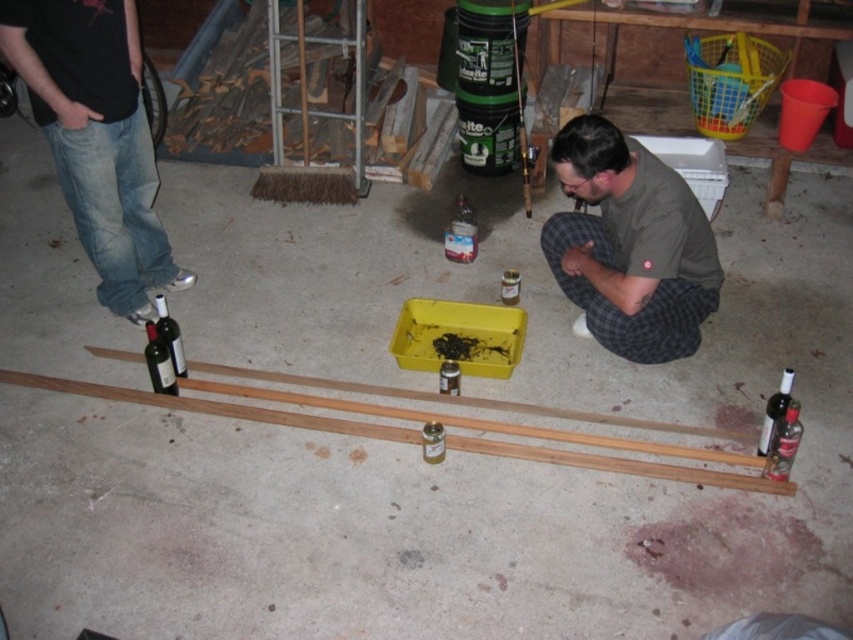
Where is `clear plastic bottle at center`? This screenshot has height=640, width=853. clear plastic bottle at center is located at coordinates (460, 232).

Looking at this image, who is more forward, (x=453, y=252) or (x=756, y=445)?

Positioned in front is point (x=756, y=445).

Identify the location of clear plastic bottle at center. The height and width of the screenshot is (640, 853). (460, 232).

Between green cotton shirt at lower center and translucent glass bottle at lower right, which one is positioned higher?

green cotton shirt at lower center is higher up.

Which is behind, point (613, 236) or point (793, 397)?

The point (613, 236) is more distant.

Measure the distance between green cotton shirt at lower center and camera.

green cotton shirt at lower center is 2.44 meters from camera.

You are a GUI agent. You are given a task and a screenshot of the screen. Output one action in this format:
    pyautogui.click(x=<x>, y=<y>)
    Task: Click on the green cotton shirt at lower center
    The image size is (853, 640).
    Given the screenshot: What is the action you would take?
    pyautogui.click(x=630, y=244)

Between jeans at left and matte glass wine bottle at lower left, which one is positioned lower?

Positioned lower is matte glass wine bottle at lower left.

Who is positioned more to the right, jeans at left or matte glass wine bottle at lower left?

matte glass wine bottle at lower left is more to the right.

Describe the element at coordinates (96, 138) in the screenshot. The image size is (853, 640). I see `jeans at left` at that location.

Locate an element on the screen. The height and width of the screenshot is (640, 853). jeans at left is located at coordinates point(96,138).